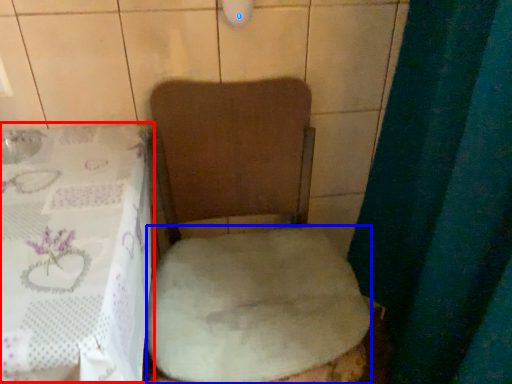
Question: Which object is closer to the camera taking this photo, table (highlighted by a red box) or sheet (highlighted by a blue box)?

Choices:
 (A) table
 (B) sheet

Answer: (A)